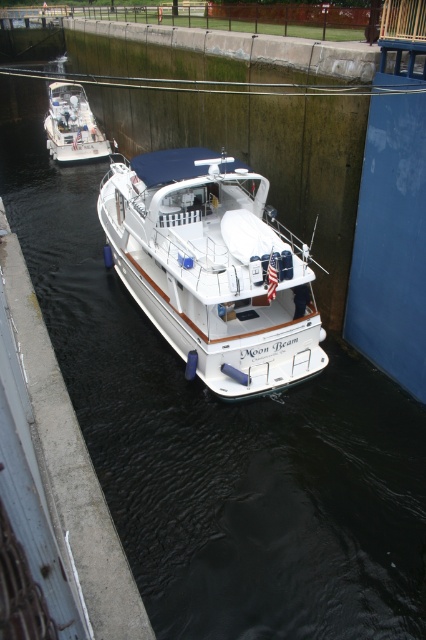
Which of these two, white glossy boat at center or white glossy boat at upper left, stands taller?

Standing taller between the two is white glossy boat at center.

Measure the distance between white glossy boat at center and white glossy boat at upper left.

white glossy boat at center and white glossy boat at upper left are 13.08 meters apart from each other.

At what (x,y) coordinates should I click in order to perform the action: click on white glossy boat at center. Please return your answer as a coordinate pair (x, y). This screenshot has width=426, height=640. Looking at the image, I should click on (213, 268).

Locate an element on the screen. white glossy boat at center is located at coordinates (213, 268).